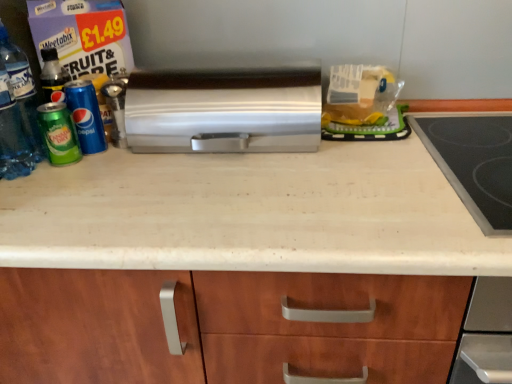
Question: Are green matte can at left, which is the 2th beverage from right to left, and satin silver toaster at center beside each other?

Choices:
 (A) yes
 (B) no

Answer: (B)

Question: Is green matte can at left, which is the 2th beverage from right to left, surrounding satin silver toaster at center?

Choices:
 (A) no
 (B) yes

Answer: (A)

Question: Can you confirm if green matte can at left, which is the 2th beverage from right to left, is taller than satin silver toaster at center?

Choices:
 (A) no
 (B) yes

Answer: (A)

Question: Does green matte can at left, the 1th beverage positioned from the left, come in front of satin silver toaster at center?

Choices:
 (A) yes
 (B) no

Answer: (B)

Question: Is green matte can at left, the 1th beverage positioned from the left, to the right of satin silver toaster at center from the viewer's perspective?

Choices:
 (A) no
 (B) yes

Answer: (A)

Question: In terms of size, does green matte can at left, which is the 2th beverage from right to left, appear bigger or smaller than satin silver toaster at center?

Choices:
 (A) small
 (B) big

Answer: (A)

Question: Is green matte can at left, which is the 2th beverage from right to left, taller or shorter than satin silver toaster at center?

Choices:
 (A) tall
 (B) short

Answer: (B)

Question: Visually, is green matte can at left, which is the 2th beverage from right to left, positioned to the left or to the right of satin silver toaster at center?

Choices:
 (A) left
 (B) right

Answer: (A)

Question: Is point (60, 147) positioned closer to the camera than point (162, 77)?

Choices:
 (A) closer
 (B) farther

Answer: (A)

Question: Would you say satin silver toaster at center is to the left or to the right of translucent plastic bottle at left in the picture?

Choices:
 (A) right
 (B) left

Answer: (A)

Question: From a real-world perspective, relative to translucent plastic bottle at left, is satin silver toaster at center vertically above or below?

Choices:
 (A) below
 (B) above

Answer: (A)

Question: Considering the positions of point (267, 94) and point (37, 142), is point (267, 94) closer or farther from the camera than point (37, 142)?

Choices:
 (A) farther
 (B) closer

Answer: (B)

Question: From the image's perspective, is satin silver toaster at center located above or below translucent plastic bottle at left?

Choices:
 (A) below
 (B) above

Answer: (B)

Question: Is satin silver toaster at center inside the boundaries of green matte can at left, the 2th beverage in the left-to-right sequence, or outside?

Choices:
 (A) outside
 (B) inside

Answer: (A)

Question: Considering the positions of point (282, 137) and point (72, 91), is point (282, 137) closer or farther from the camera than point (72, 91)?

Choices:
 (A) farther
 (B) closer

Answer: (A)